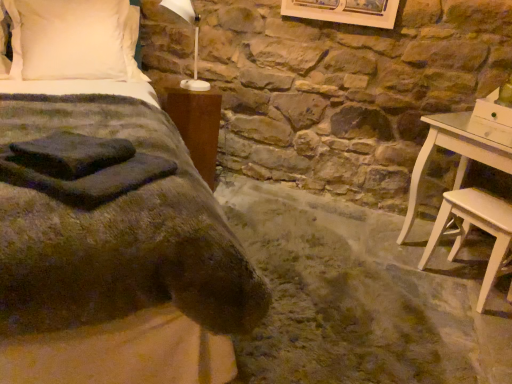
Question: Does light wood stool at lower right turn towards brown wood nightstand at left?

Choices:
 (A) yes
 (B) no

Answer: (B)

Question: Can you confirm if light wood stool at lower right is thinner than brown wood nightstand at left?

Choices:
 (A) yes
 (B) no

Answer: (A)

Question: Is light wood stool at lower right shorter than brown wood nightstand at left?

Choices:
 (A) no
 (B) yes

Answer: (B)

Question: From the image's perspective, does light wood stool at lower right appear lower than brown wood nightstand at left?

Choices:
 (A) no
 (B) yes

Answer: (B)

Question: Can you confirm if light wood stool at lower right is positioned to the left of brown wood nightstand at left?

Choices:
 (A) yes
 (B) no

Answer: (B)

Question: Which is correct: dark green fabric bed at center is inside white soft pillow at upper left, or outside of it?

Choices:
 (A) inside
 (B) outside

Answer: (B)

Question: Considering their positions, is dark green fabric bed at center located in front of or behind white soft pillow at upper left?

Choices:
 (A) front
 (B) behind

Answer: (A)

Question: Is point (153, 114) positioned closer to the camera than point (81, 44)?

Choices:
 (A) closer
 (B) farther

Answer: (A)

Question: From the image's perspective, is dark green fabric bed at center positioned above or below white soft pillow at upper left?

Choices:
 (A) below
 (B) above

Answer: (A)

Question: Based on their sizes in the image, would you say brown wood nightstand at left is bigger or smaller than light wood stool at lower right?

Choices:
 (A) big
 (B) small

Answer: (A)

Question: Considering the positions of brown wood nightstand at left and light wood stool at lower right in the image, is brown wood nightstand at left taller or shorter than light wood stool at lower right?

Choices:
 (A) tall
 (B) short

Answer: (A)

Question: Is brown wood nightstand at left spatially inside light wood stool at lower right, or outside of it?

Choices:
 (A) outside
 (B) inside

Answer: (A)

Question: From a real-world perspective, is brown wood nightstand at left positioned above or below light wood stool at lower right?

Choices:
 (A) above
 (B) below

Answer: (A)

Question: From the image's perspective, is brown wood nightstand at left above or below dark green fabric bed at center?

Choices:
 (A) above
 (B) below

Answer: (A)

Question: Relative to dark green fabric bed at center, is brown wood nightstand at left in front or behind?

Choices:
 (A) front
 (B) behind

Answer: (B)